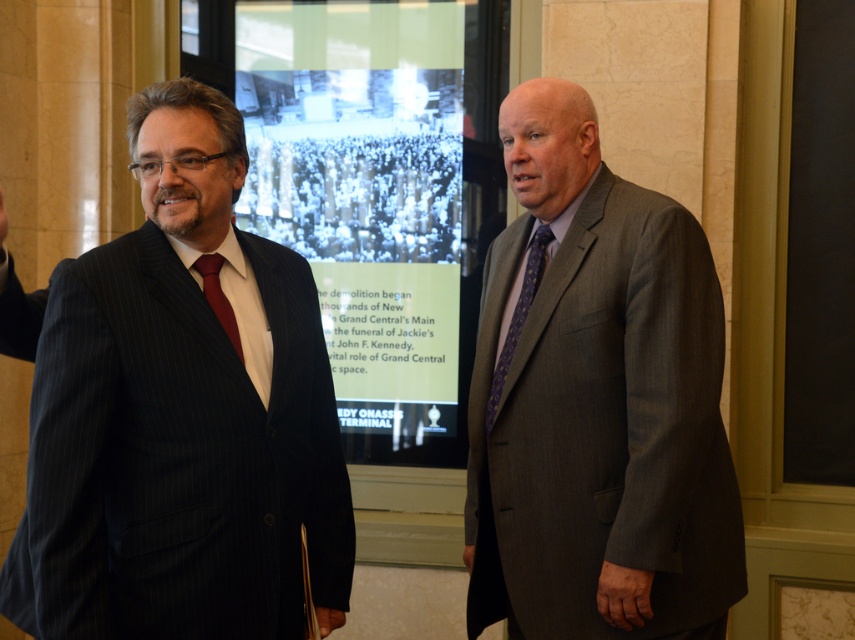
Question: Which point is farther to the camera?

Choices:
 (A) gray pinstripe suit at right
 (B) matte red tie at left
 (C) purple textured tie at right

Answer: (C)

Question: Which point is farther to the camera?

Choices:
 (A) matte black suit at left
 (B) blackboard at right

Answer: (B)

Question: Is blackboard at right thinner than purple textured tie at right?

Choices:
 (A) no
 (B) yes

Answer: (A)

Question: Is purple textured tie at right positioned in front of matte red tie at left?

Choices:
 (A) no
 (B) yes

Answer: (A)

Question: Which point is farther from the camera taking this photo?

Choices:
 (A) (246, 307)
 (B) (217, 310)

Answer: (A)

Question: Considering the relative positions of matte black suit at left and purple textured tie at right in the image provided, where is matte black suit at left located with respect to purple textured tie at right?

Choices:
 (A) right
 (B) left

Answer: (B)